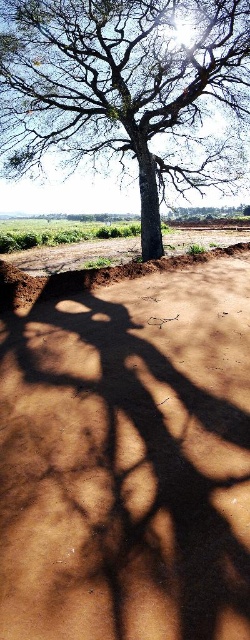
Which is behind, point (43, 365) or point (131, 51)?

The point (131, 51) is behind.

Measure the distance between point (x=221, y=483) and camera.

Point (x=221, y=483) and camera are 3.23 meters apart.

Locate an element on the screen. brown sandy soil at center is located at coordinates (128, 460).